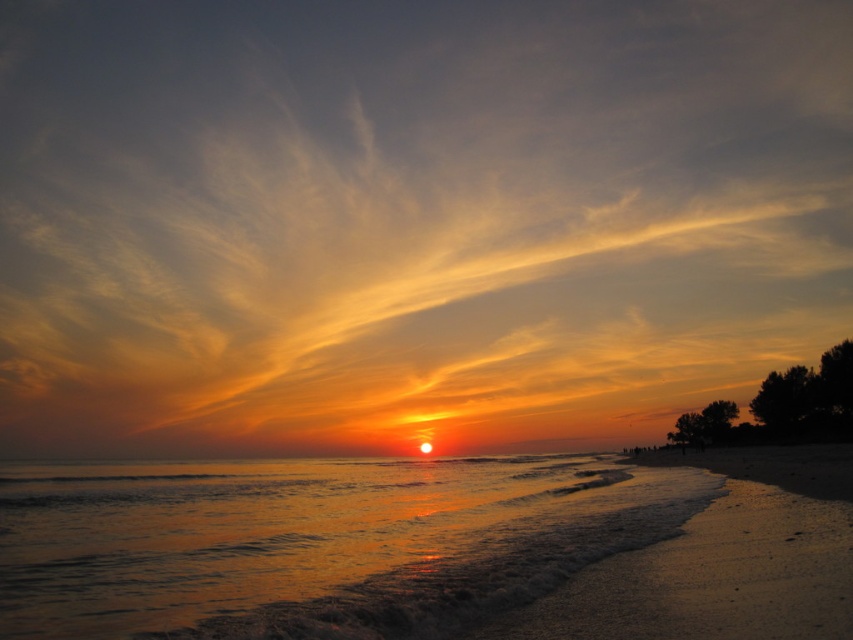
You are a photographer trying to capture the sunset reflection on the water. You have a camera with a wide angle lens that can capture large areas. Which object between the glistening golden water at center and the sandy beach at lower right should you focus on to ensure the sunset reflection is fully visible?

The glistening golden water at center has a larger size compared to sandy beach at lower right, so focusing on it will ensure the sunset reflection is fully visible due to its greater area.